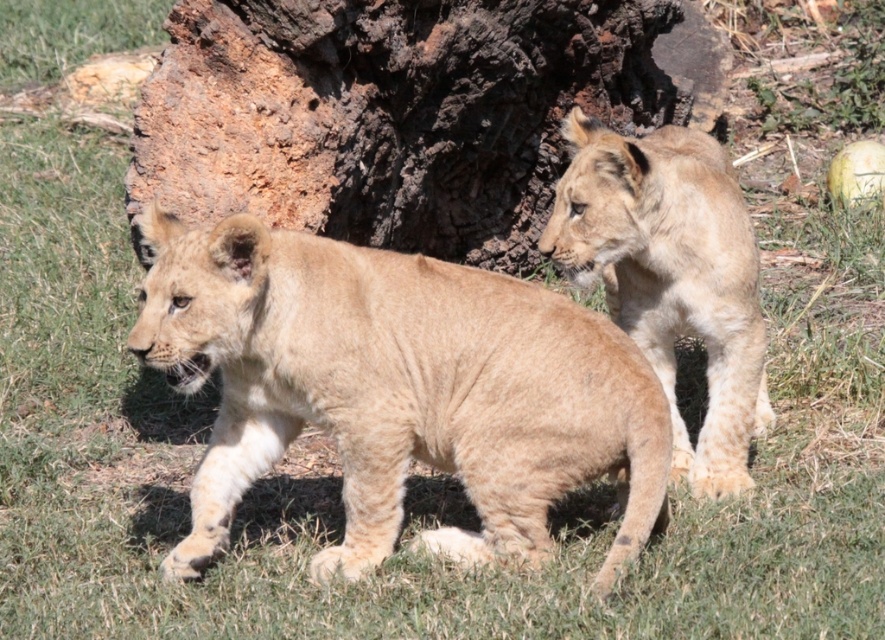
Question: Is fuzzy beige lion cub at center bigger than light brown fur at right?

Choices:
 (A) no
 (B) yes

Answer: (B)

Question: Which point appears closest to the camera in this image?

Choices:
 (A) (741, 200)
 (B) (491, 312)

Answer: (B)

Question: Is fuzzy beige lion cub at center closer to camera compared to light brown fur at right?

Choices:
 (A) yes
 (B) no

Answer: (A)

Question: Does fuzzy beige lion cub at center appear on the left side of light brown fur at right?

Choices:
 (A) yes
 (B) no

Answer: (A)

Question: Which of the following is the farthest from the observer?

Choices:
 (A) light brown fur at right
 (B) fuzzy beige lion cub at center

Answer: (A)

Question: Which of the following is the closest to the observer?

Choices:
 (A) (262, 291)
 (B) (575, 252)

Answer: (A)